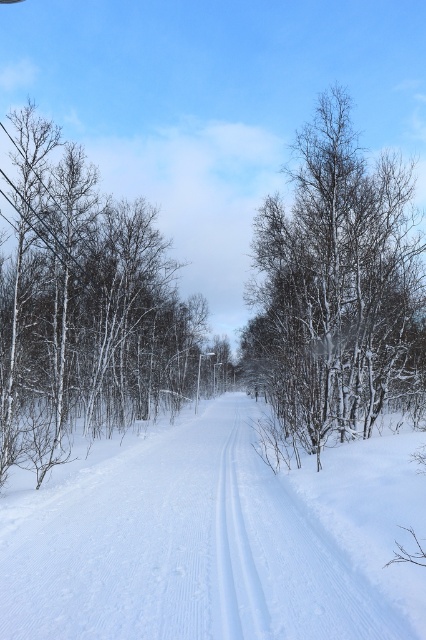
You are a cross country skier preparing to glide along the snow trail. You notice the white powdery snow at center and the white snow trail at center. Which surface should you choose to ensure smoother gliding?

You should choose the white snow trail at center because it is taller than the white powdery snow at center, providing a smoother surface for gliding.

You are standing at the starting point of the snow road and want to reach the end point. The points on the road are marked as point 1 at coordinates point [132,481] and point 2 at coordinates point [250,554]. Which point should you head towards first to reach the end?

Point 1 at coordinates point [132,481] is behind point 2 at coordinates point [250,554], so you should head towards point 2 first before reaching point 1.

You are standing at the origin point of the coordinate system. You want to walk to the white powdery snow at center. In which direction should you go?

The white powdery snow at center is located at coordinate point [213,538], so you should move towards the positive x direction to reach it.